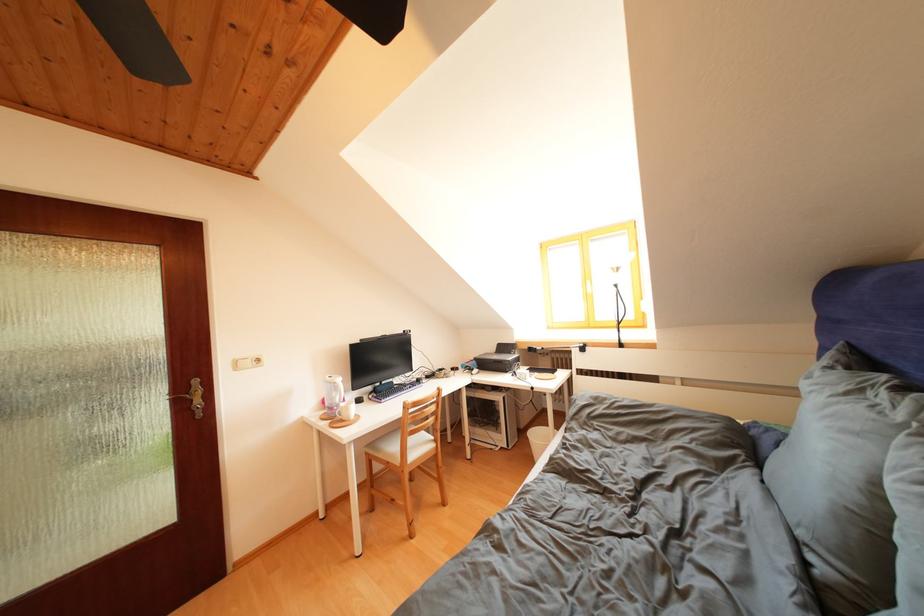
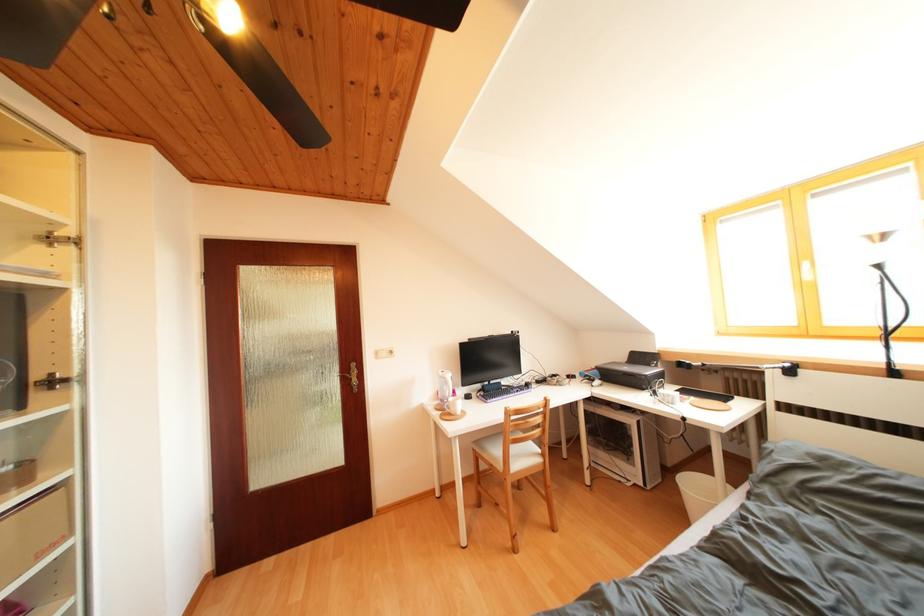
Question: Based on the continuous images, in which direction is the camera rotating? Reply with the corresponding letter.

Choices:
 (A) Left
 (B) Right
 (C) Up
 (D) Down

Answer: (A)